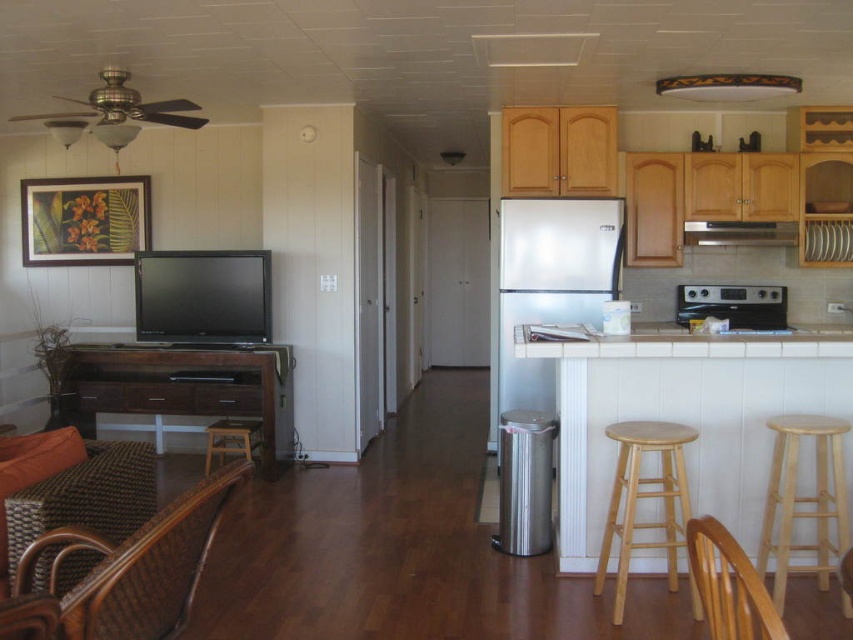
You are planning to place a 1.2 meter wide rug in this living area. You see the woven brown chair at lower left and the wooden bar stool at lower center. Which object requires a smaller space to accommodate its width?

The woven brown chair at lower left requires a smaller space to accommodate its width because its width is less than that of the wooden bar stool at lower center.

In the scene shown: You are standing in the middle of the room and want to place a potted plant on the floor near the white stainless steel refrigerator at center. Is the woven brown chair at lower left positioned to the left or right of the refrigerator?

The woven brown chair at lower left is positioned to the left of the white stainless steel refrigerator at center because the refrigerator is above it, meaning it is further to the right in the room.